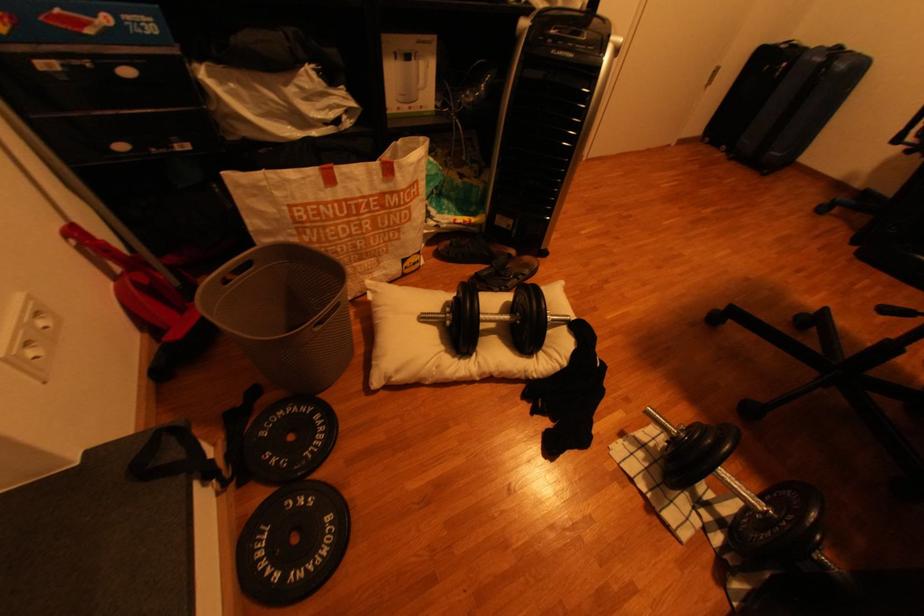
Where is `black dumbbell`? This screenshot has width=924, height=616. black dumbbell is located at coordinates (496, 318).